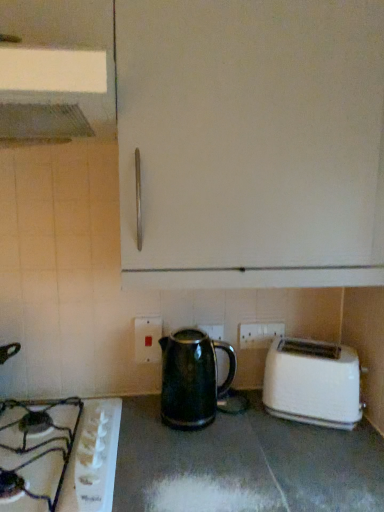
The height and width of the screenshot is (512, 384). In order to click on blank space to the left of green glossy kettle at center in this screenshot , I will do `click(139, 416)`.